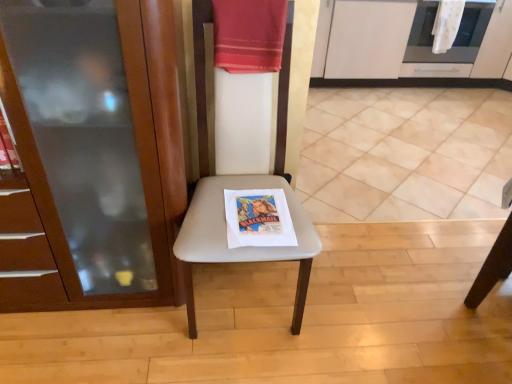
I want to click on vacant region below beige fabric chair at center (from a real-world perspective), so click(243, 297).